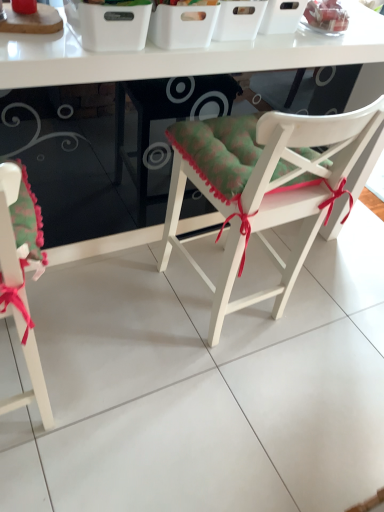
The width and height of the screenshot is (384, 512). I want to click on vacant location below white wood chair at center, arranged as the 1th chair when viewed from the right (from a real-world perspective), so click(224, 316).